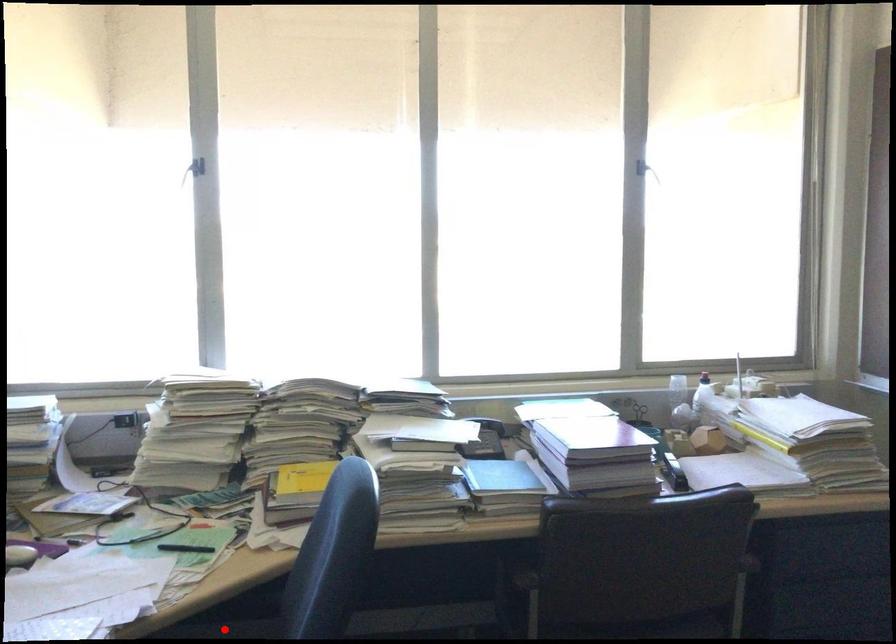
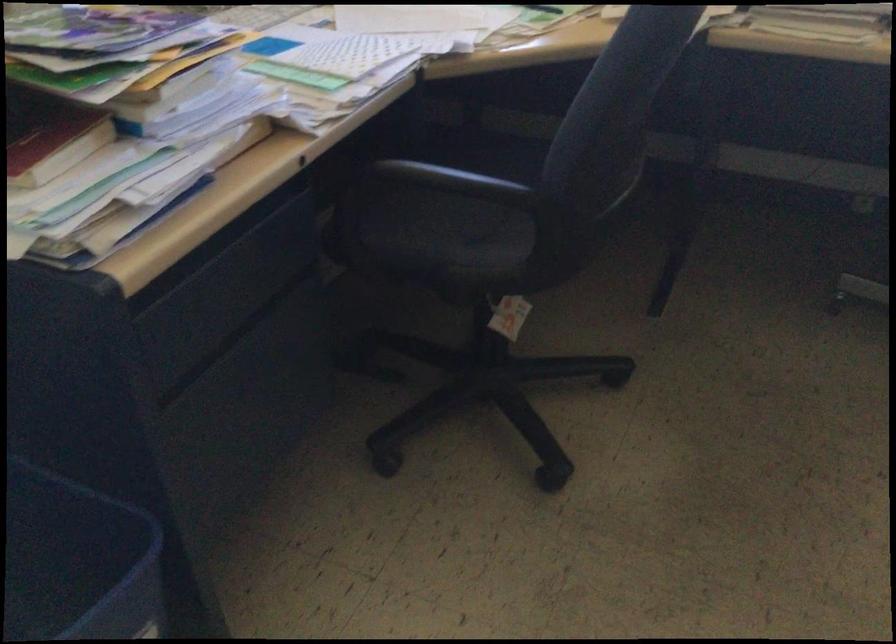
Question: I am providing you with two images of the same scene from different viewpoints. A red point is marked on the first image. Is the red point's position out of view in image 2?

Choices:
 (A) Yes
 (B) No

Answer: (A)